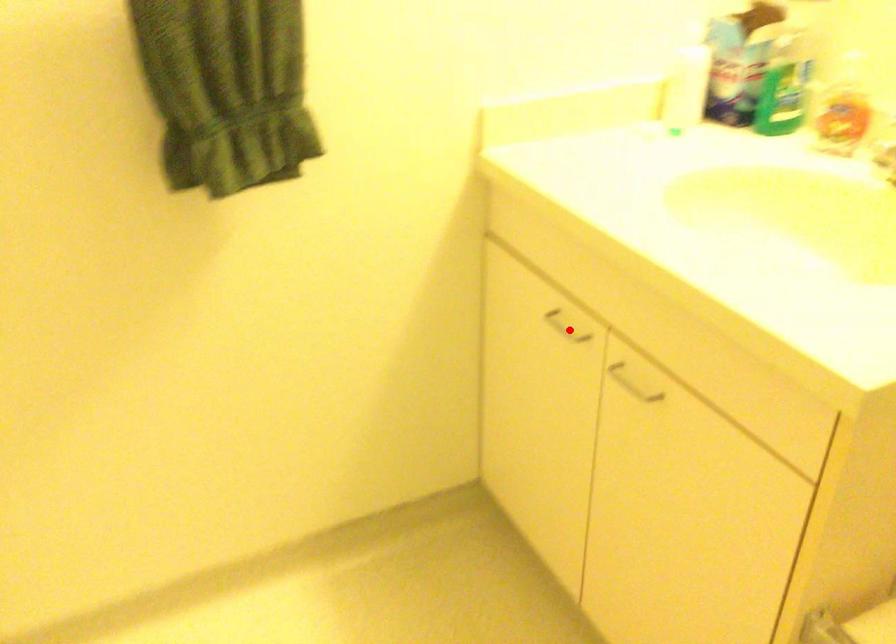
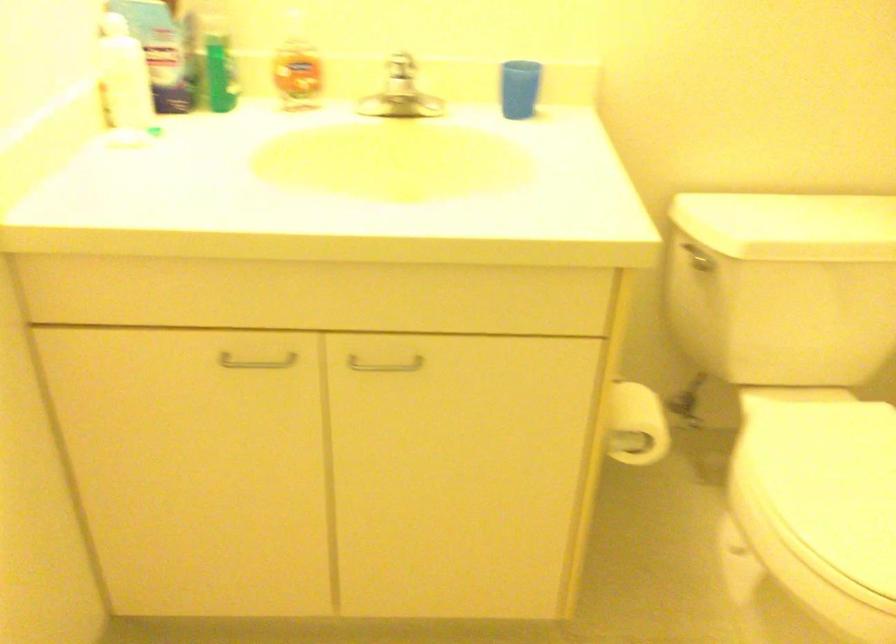
Question: I am providing you with two images of the same scene from different viewpoints. A red point is shown in image1. For the corresponding object point in image2, is it positioned nearer or farther from the camera?

Choices:
 (A) Nearer
 (B) Farther

Answer: (A)